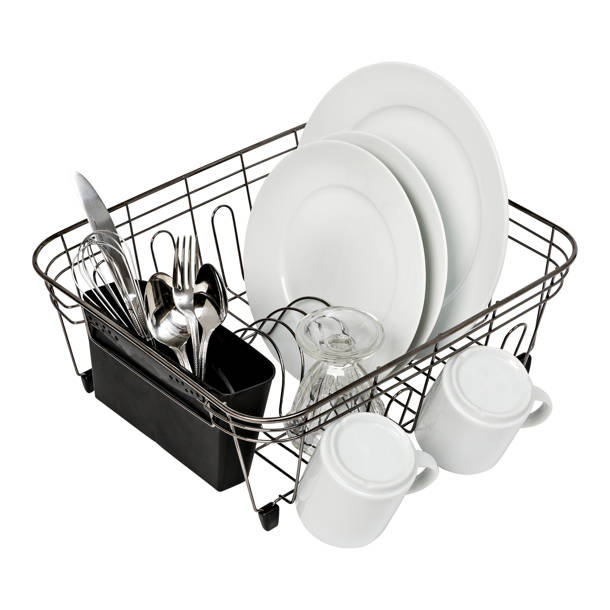
The width and height of the screenshot is (610, 610). What are the coordinates of `cups` in the screenshot? It's located at (341, 379), (366, 464), (467, 399).